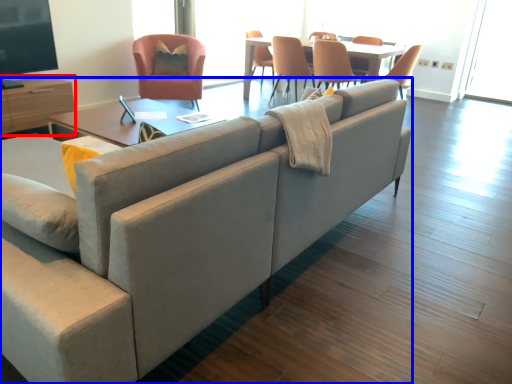
Question: Which object is closer to the camera taking this photo, entertainment center (highlighted by a red box) or studio couch (highlighted by a blue box)?

Choices:
 (A) entertainment center
 (B) studio couch

Answer: (B)